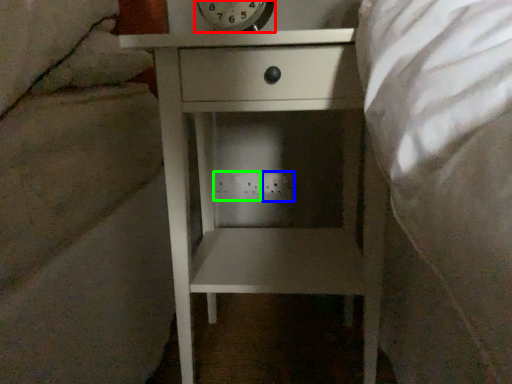
Question: Considering the real-world distances, which object is closest to alarm clock (highlighted by a red box)? electric outlet (highlighted by a blue box) or electric outlet (highlighted by a green box).

Choices:
 (A) electric outlet
 (B) electric outlet

Answer: (B)